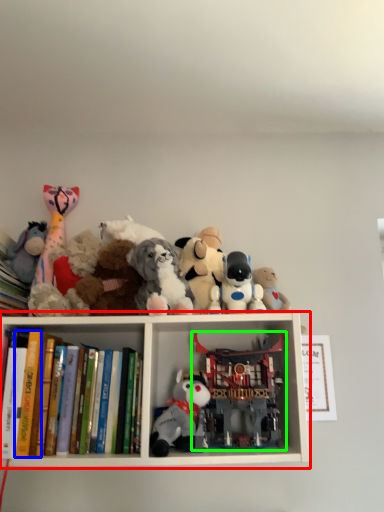
Question: Which object is the farthest from shelf (highlighted by a red box)? Choose among these: paperback book (highlighted by a blue box) or toy (highlighted by a green box).

Choices:
 (A) paperback book
 (B) toy

Answer: (A)